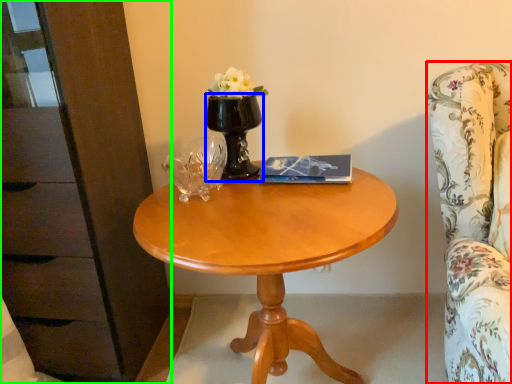
Question: Which object is positioned closest to chair (highlighted by a red box)? Select from vase (highlighted by a blue box) and dresser (highlighted by a green box).

Choices:
 (A) vase
 (B) dresser

Answer: (A)